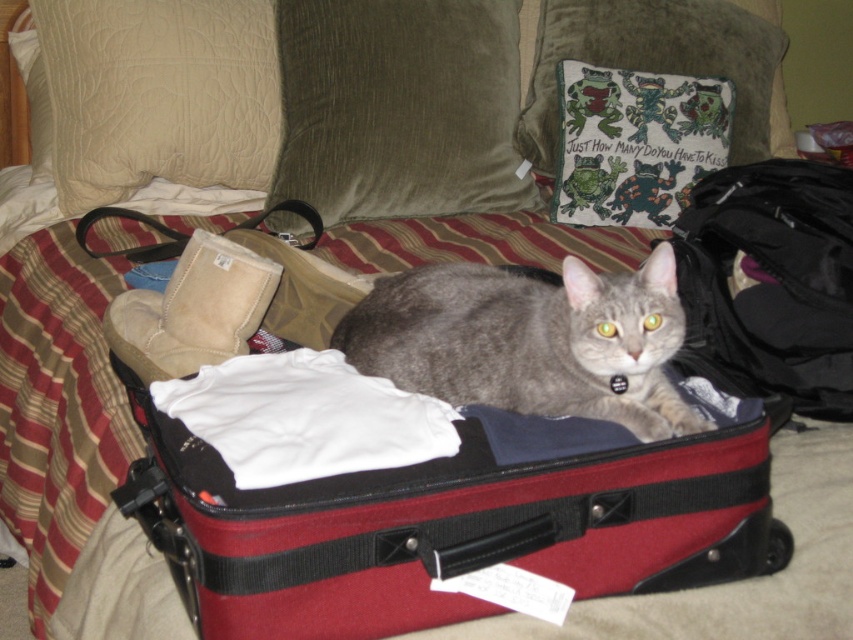
You are packing for a trip and see the velvety olive green pillow at upper center and the soft black fabric at center in your suitcase. Which item takes up more space in the suitcase?

The soft black fabric at center takes up more space than the velvety olive green pillow at upper center because the velvety olive green pillow at upper center occupies less space than soft black fabric at center.

You are trying to locate two points in the image. The first point is at coordinates point [566,289] and the second is at point [250,104]. Which point is closer to the viewer?

Point [566,289] is in front of point [250,104], so it is closer to the viewer.

You are packing for a trip and need to place a beige quilted pillow into your luggage. Based on the scene, can the beige quilted pillow at upper left fit into the matte black suitcase at center without removing any items already inside?

The matte black suitcase at center is in front of the beige quilted pillow at upper left, but this spatial relationship doesn not indicate the size of the suitcase. Therefore, it is unclear if the beige quilted pillow at upper left will fit inside the matte black suitcase at center without removing existing items.